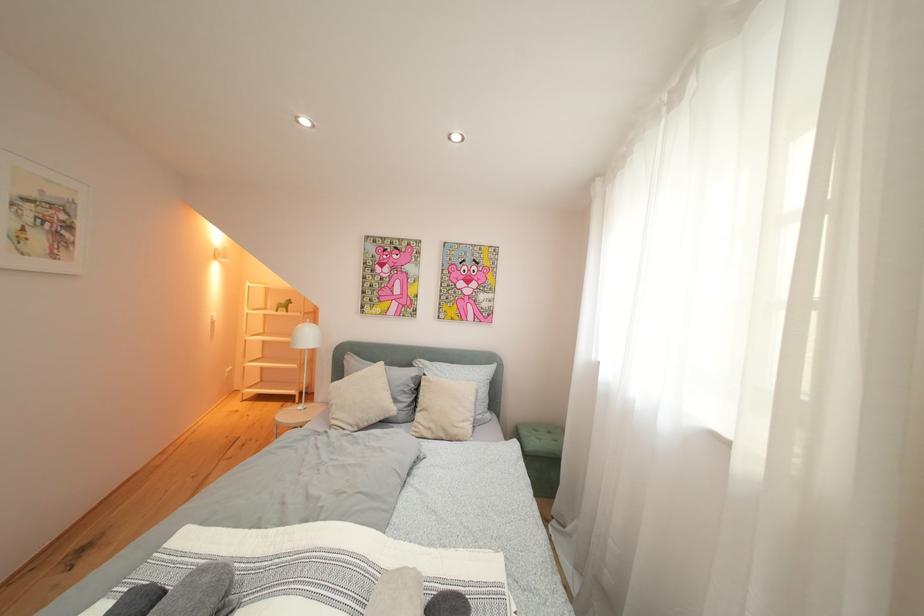
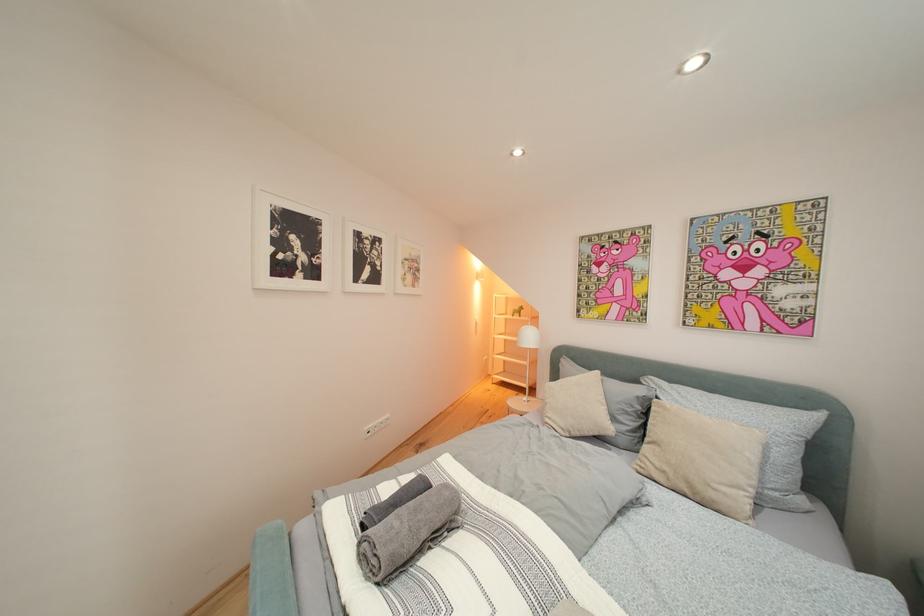
Question: Based on the continuous images, in which direction is the camera rotating? Reply with the corresponding letter.

Choices:
 (A) Left
 (B) Right
 (C) Up
 (D) Down

Answer: (A)